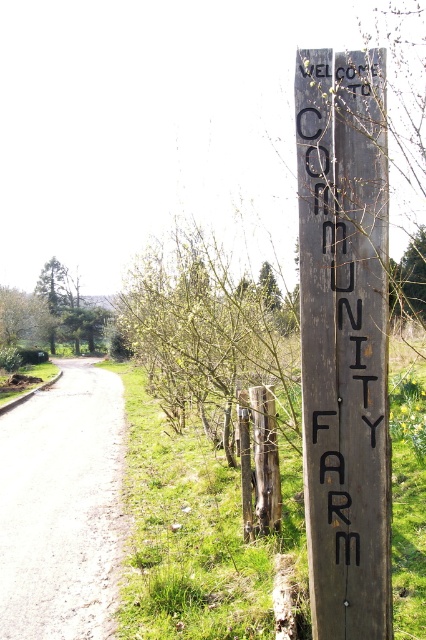
Between point (356, 285) and point (51, 461), which one is positioned in front?

Positioned in front is point (356, 285).

Locate an element on the screen. The height and width of the screenshot is (640, 426). wooden signboard at right is located at coordinates (344, 339).

Identify the location of wooden signboard at right. (344, 339).

Where is `green grass at center`? green grass at center is located at coordinates (195, 531).

From the picture: Can you confirm if green grass at center is positioned to the left of gravel path at center?

In fact, green grass at center is to the right of gravel path at center.

Does point (394, 538) come behind point (11, 522)?

No, it is in front of (11, 522).

Where is `green grass at center`? green grass at center is located at coordinates (195, 531).

Which of these two, wooden signboard at right or green grass at center, stands taller?

wooden signboard at right

Who is positioned more to the right, wooden signboard at right or green grass at center?

wooden signboard at right

Locate an element on the screen. This screenshot has width=426, height=640. wooden signboard at right is located at coordinates (344, 339).